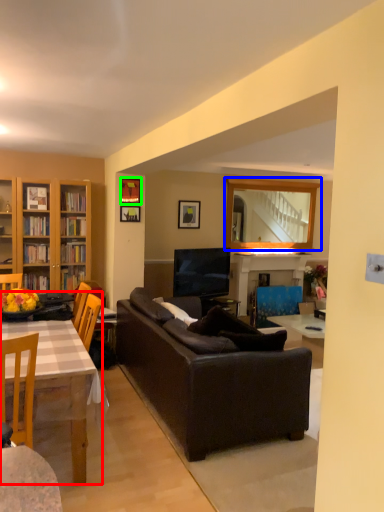
Question: Based on their relative distances, which object is farther from table (highlighted by a red box)? Choose from mirror (highlighted by a blue box) and picture frame (highlighted by a green box).

Choices:
 (A) mirror
 (B) picture frame

Answer: (A)